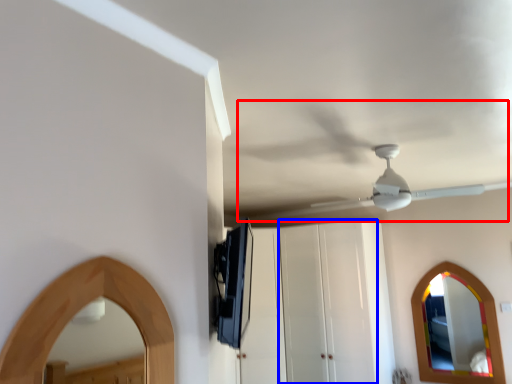
Question: Among these objects, which one is farthest to the camera, fan (highlighted by a red box) or glass door (highlighted by a blue box)?

Choices:
 (A) fan
 (B) glass door

Answer: (B)